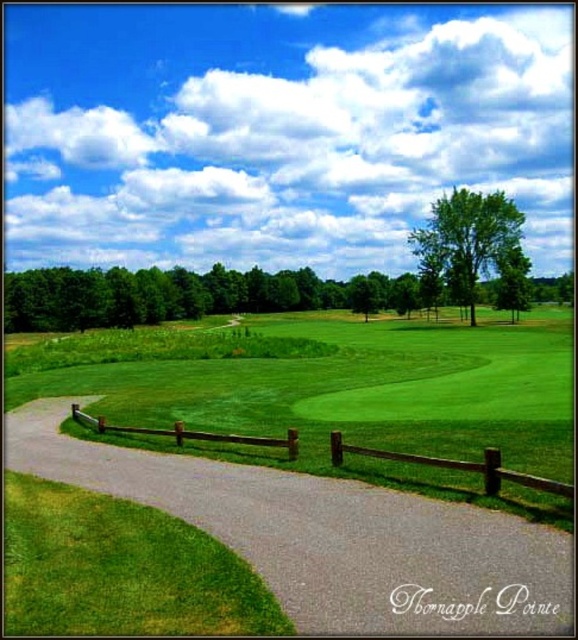
Is point (506, 214) less distant than point (272, 444)?

No, (506, 214) is behind (272, 444).

Between green leafy tree at center and brown wooden fence at center, which one appears on the left side from the viewer's perspective?

From the viewer's perspective, brown wooden fence at center appears more on the left side.

Who is more forward, (464, 298) or (397, 460)?

Positioned in front is point (397, 460).

This screenshot has width=578, height=640. Find the location of `green leafy tree at center`. green leafy tree at center is located at coordinates (468, 237).

Is gray asphalt path at center thinner than brown wooden fence at center?

In fact, gray asphalt path at center might be wider than brown wooden fence at center.

At what (x,y) coordinates should I click in order to perform the action: click on gray asphalt path at center. Please return your answer as a coordinate pair (x, y). The height and width of the screenshot is (640, 578). Looking at the image, I should click on (328, 536).

Can you confirm if gray asphalt path at center is positioned above green leafy tree at center?

Incorrect, gray asphalt path at center is not positioned above green leafy tree at center.

Is gray asphalt path at center smaller than green leafy tree at center?

Yes, gray asphalt path at center is smaller than green leafy tree at center.

Is point (513, 588) closer to viewer compared to point (453, 236)?

Yes, point (513, 588) is in front of point (453, 236).

Where is `gray asphalt path at center`? This screenshot has width=578, height=640. gray asphalt path at center is located at coordinates (328, 536).